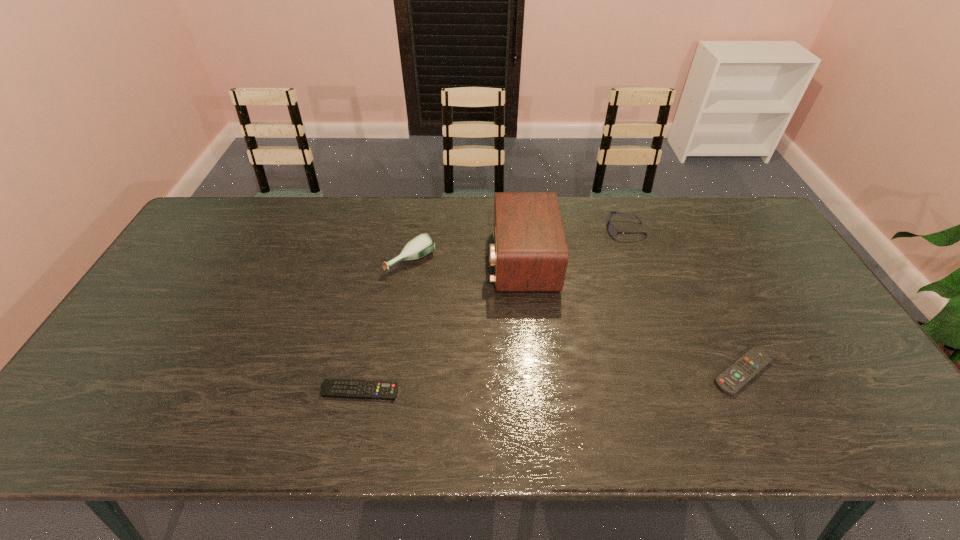
Locate an element on the screen. Image resolution: width=960 pixels, height=540 pixels. radio receiver is located at coordinates (530, 253).

Find the location of a particular element. the tallest object is located at coordinates (530, 253).

Where is `bottle`? The width and height of the screenshot is (960, 540). bottle is located at coordinates click(422, 245).

Where is `the third shortest object`? The height and width of the screenshot is (540, 960). the third shortest object is located at coordinates (612, 230).

Identify the location of the fourth object from left to right. (612, 230).

Find the location of a particular element. Image resolution: width=960 pixels, height=540 pixels. the right remote control is located at coordinates (736, 376).

Where is `the left remote control`? the left remote control is located at coordinates (336, 388).

Locate an element on the screen. The width and height of the screenshot is (960, 540). vacant space located 0.390m on the front panel of the third object from right to left is located at coordinates (363, 261).

Where is `vacant region located 0.060m on the front panel of the third object from right to left`? vacant region located 0.060m on the front panel of the third object from right to left is located at coordinates (469, 261).

The image size is (960, 540). Find the location of `vacant space located on the front panel of the third object from right to left`. vacant space located on the front panel of the third object from right to left is located at coordinates (457, 261).